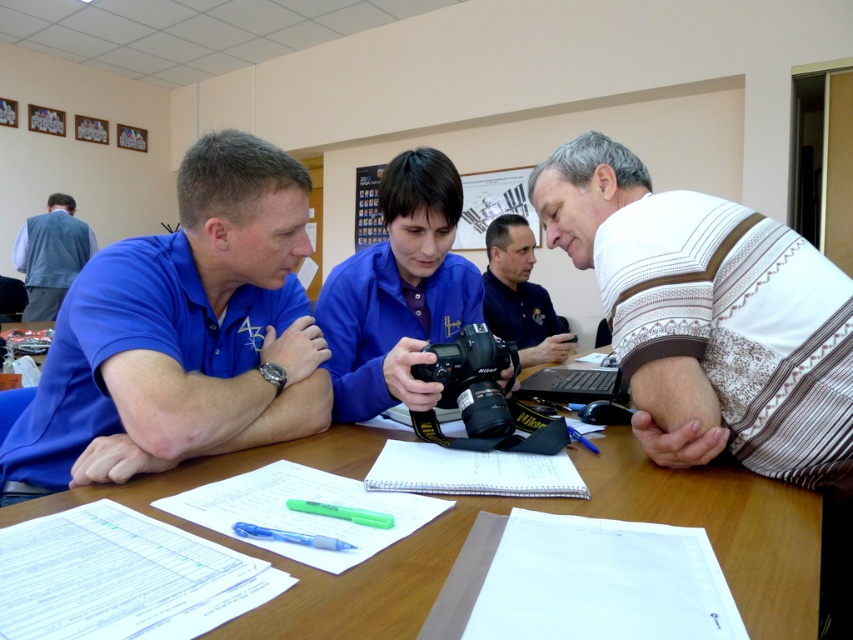
Question: Among these objects, which one is farthest from the camera?

Choices:
 (A) green matte pen at lower center
 (B) wooden table at center
 (C) matte black camera at center
 (D) blue smooth shirt at left

Answer: (C)

Question: Is black plastic laptop at center further to the viewer compared to green matte pen at lower center?

Choices:
 (A) yes
 (B) no

Answer: (A)

Question: Which point is closer to the camera taking this photo?

Choices:
 (A) (677, 492)
 (B) (508, 317)

Answer: (A)

Question: Is matte black camera at center to the right of green matte pen at lower center from the viewer's perspective?

Choices:
 (A) no
 (B) yes

Answer: (B)

Question: Which object is the farthest from the white striped sweater at right?

Choices:
 (A) light blue denim vest at upper left
 (B) wooden table at center
 (C) matte black camera at center

Answer: (A)

Question: Does blue smooth shirt at left have a larger size compared to translucent blue pen at lower left?

Choices:
 (A) yes
 (B) no

Answer: (A)